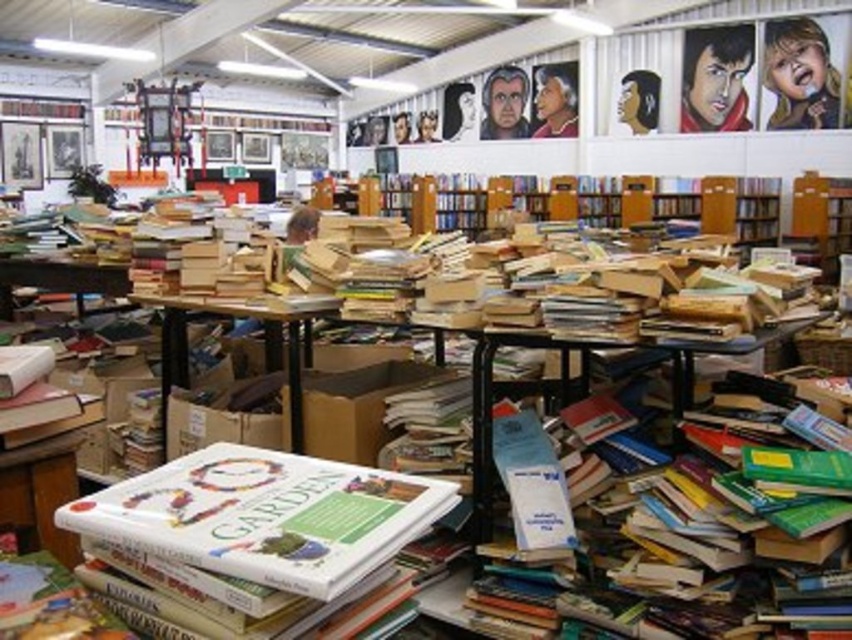
Measure the distance between hardcover books at center and camera.

6.11 feet

The image size is (852, 640). What do you see at coordinates (714, 550) in the screenshot?
I see `hardcover books at center` at bounding box center [714, 550].

You are a GUI agent. You are given a task and a screenshot of the screen. Output one action in this format:
    pyautogui.click(x=<x>, y=<y>)
    Task: Click on the hardcover books at center
    
    Given the screenshot: What is the action you would take?
    pyautogui.click(x=714, y=550)

Where is `hardcover books at center`? hardcover books at center is located at coordinates (714, 550).

Between point (620, 493) and point (285, 369), which one is positioned in front?

Positioned in front is point (620, 493).

Describe the element at coordinates (714, 550) in the screenshot. I see `hardcover books at center` at that location.

The image size is (852, 640). Identify the location of hardcover books at center. (714, 550).

Is the position of hardcover books at center more distant than that of hardcover book at center?

Yes, hardcover books at center is behind hardcover book at center.

Which is in front, point (646, 621) or point (358, 572)?

Positioned in front is point (358, 572).

Where is `hardcover books at center`? hardcover books at center is located at coordinates (714, 550).